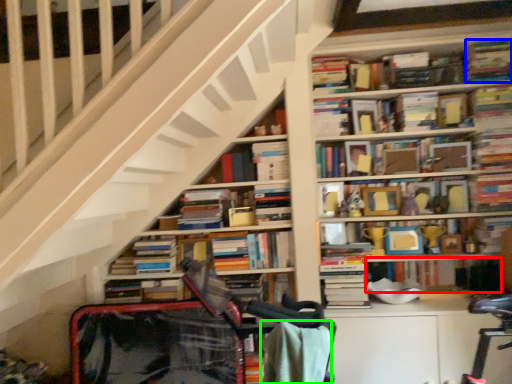
Question: Estimate the real-world distances between objects in this image. Which object is closer to book (highlighted by a red box), book (highlighted by a blue box) or blanket (highlighted by a green box)?

Choices:
 (A) book
 (B) blanket

Answer: (A)